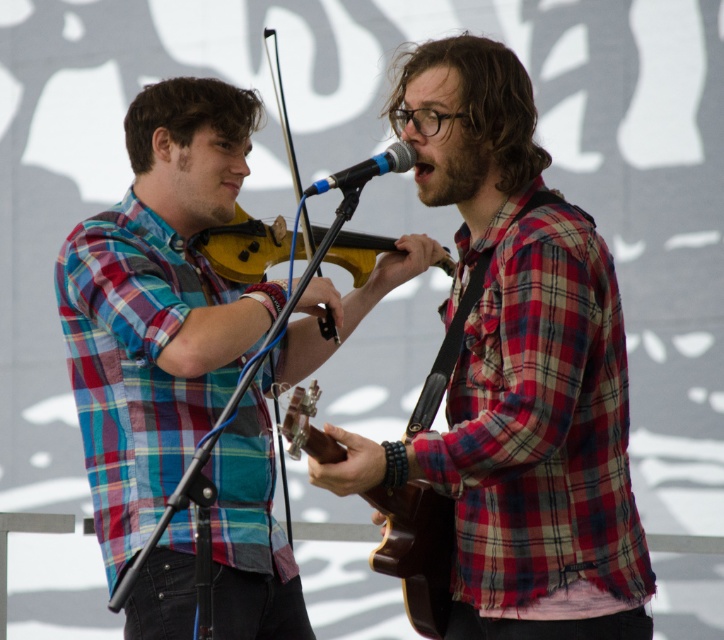
Question: Which object is the farthest from the wooden violin at center?

Choices:
 (A) plaid shirt at center
 (B) brown wooden violin at center
 (C) blue metallic microphone at center

Answer: (C)

Question: Which object is positioned closest to the plaid shirt at center?

Choices:
 (A) wooden violin at center
 (B) plaid shirt violinist at center

Answer: (A)

Question: Which of the following is the farthest from the observer?

Choices:
 (A) wooden violin at center
 (B) plaid shirt violinist at center
 (C) brown wooden violin at center
 (D) plaid shirt at center

Answer: (B)

Question: Is brown wooden violin at center bigger than wooden violin at center?

Choices:
 (A) yes
 (B) no

Answer: (B)

Question: Can you confirm if plaid shirt at center is wider than brown wooden violin at center?

Choices:
 (A) yes
 (B) no

Answer: (A)

Question: Does wooden violin at center have a smaller size compared to blue metallic microphone at center?

Choices:
 (A) yes
 (B) no

Answer: (B)